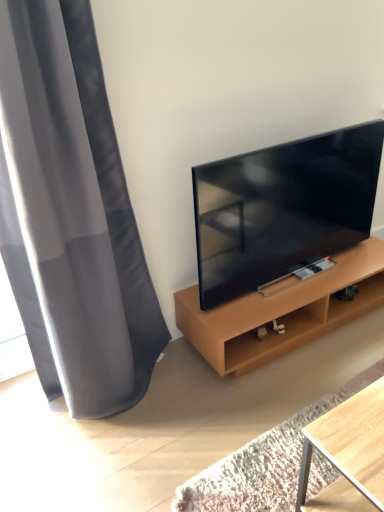
Question: Looking at their shapes, would you say matte black tv at right is wider or thinner than wooden shelf at right?

Choices:
 (A) thin
 (B) wide

Answer: (A)

Question: Based on their positions, is matte black tv at right located to the left or right of wooden shelf at right?

Choices:
 (A) left
 (B) right

Answer: (A)

Question: Which object is the closest to the gray fabric curtain at left?

Choices:
 (A) wooden shelf at right
 (B) matte black tv at right

Answer: (B)

Question: Based on their relative distances, which object is nearer to the matte black tv at right?

Choices:
 (A) wooden shelf at right
 (B) gray fabric curtain at left

Answer: (A)